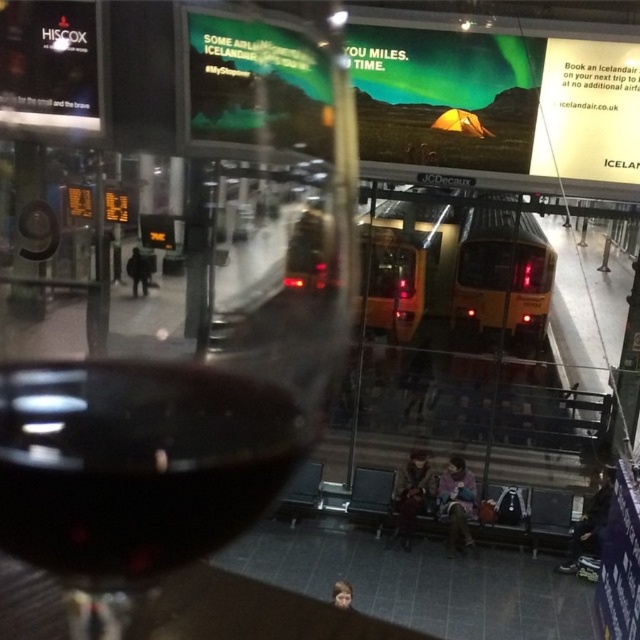
You are a bartender who needs to pour the opaque dark red wine at center into the dark glass wine at lower left. Can you do this without spilling?

The opaque dark red wine at center is above the dark glass wine at lower left, so you can pour it directly into the dark glass wine at lower left without spilling.

You are a delivery robot in the train station. Your task is to deliver a package to the platform where the two yellow trains are stopped. However, there is an opaque dark red wine at center in your path. Can you navigate around it?

The opaque dark red wine at center is located at point (172, 291). Since it is a stationary object, the delivery robot can navigate around it to reach the platform with the two yellow trains.

You are a person standing at the train station looking through the glass surface. There is an opaque dark red wine at center. Can you safely touch the wine without getting closer than 8 inches?

The opaque dark red wine at center is 8.51 inches away from viewer, so yes, you can safely touch it without getting closer than 8 inches since the distance is slightly more than required.